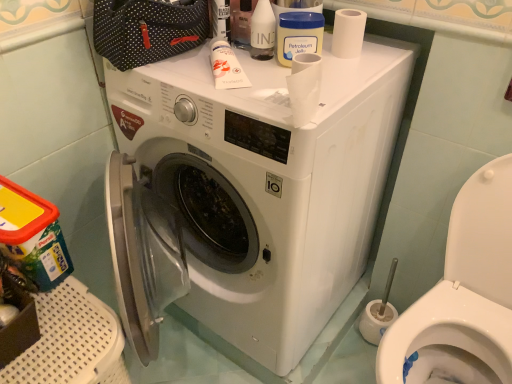
Question: Based on their positions, is translucent plastic bottle at upper center, which ranks as the first toiletry in right-to-left order, located to the left or right of white matte tube at upper center, which is the first toiletry from left to right?

Choices:
 (A) left
 (B) right

Answer: (B)

Question: From the image's perspective, is translucent plastic bottle at upper center, which ranks as the first toiletry in right-to-left order, located above or below white matte tube at upper center, the 1th toiletry ordered from the bottom?

Choices:
 (A) above
 (B) below

Answer: (A)

Question: Which is farther from the white matte toilet paper at upper right?

Choices:
 (A) white matte tube at upper center, which is the first toiletry from left to right
 (B) translucent plastic bottle at upper center, which appears as the 1th toiletry when viewed from the top
 (C) white glossy toilet at lower right
 (D) white plastic washing machine at center

Answer: (C)

Question: Which object is the farthest from the white plastic washing machine at center?

Choices:
 (A) white matte tube at upper center, the 1th toiletry ordered from the bottom
 (B) white matte toilet paper at upper right
 (C) translucent plastic bottle at upper center, the 2th toiletry in the bottom-to-top sequence
 (D) white glossy toilet at lower right

Answer: (B)